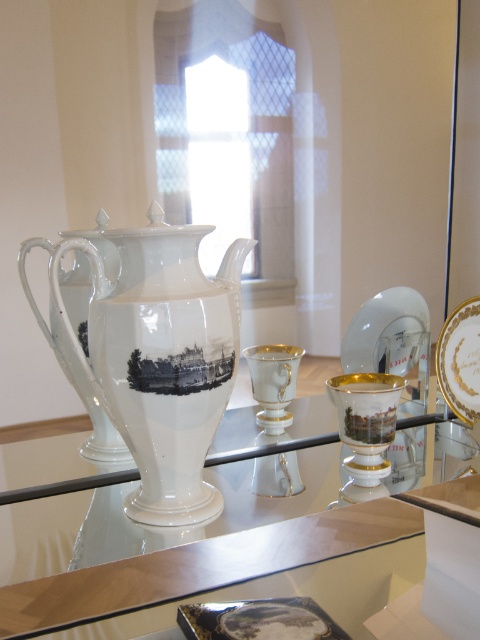
You are a museum curator trying to place the white porcelain teapot at center and the transparent glass saucer at right onto a shelf that can only hold items up to the size of the saucer. Can both items fit on the shelf?

The white porcelain teapot at center is bigger than the transparent glass saucer at right, so it cannot fit on the shelf designed for items up to the saucer size. Only the transparent glass saucer at right will fit.